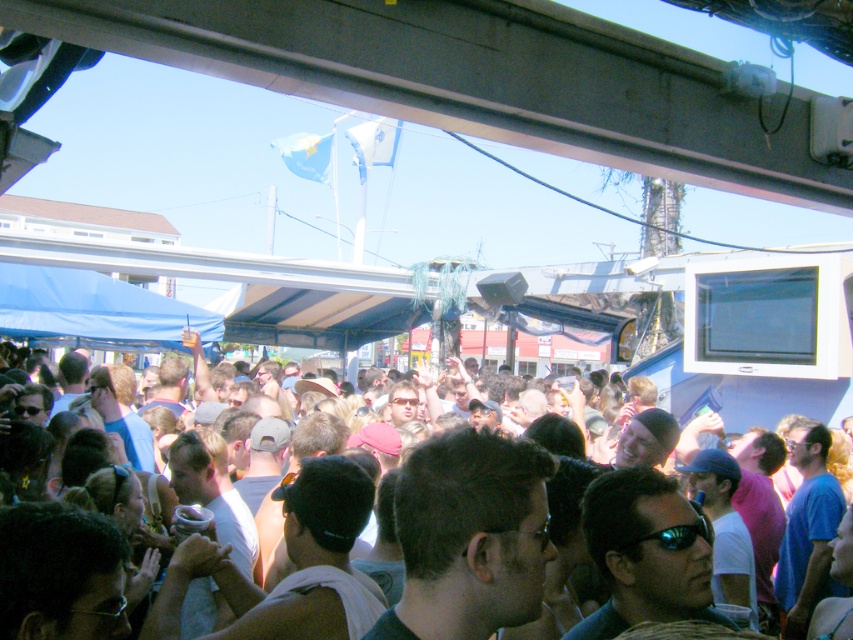
Who is positioned more to the right, white cotton shirt at center or black reflective sunglasses at center?

black reflective sunglasses at center is more to the right.

Which of these two, white cotton shirt at center or black reflective sunglasses at center, stands shorter?

With less height is black reflective sunglasses at center.

Between point (763, 440) and point (656, 532), which one is positioned in front?

Positioned in front is point (656, 532).

This screenshot has width=853, height=640. I want to click on white cotton shirt at center, so click(x=675, y=406).